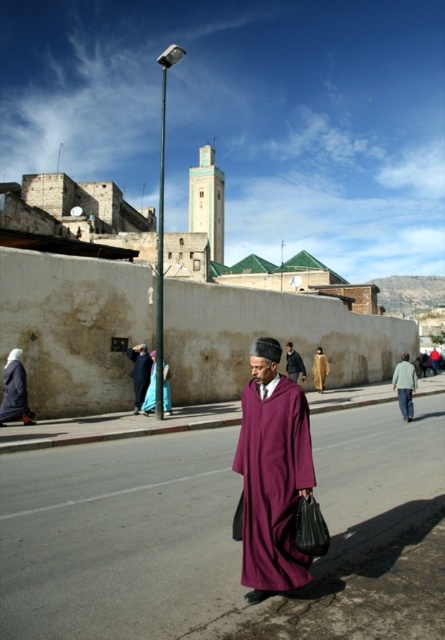
Is purple woolen robe at center taller than blue silk dress at center?

Correct, purple woolen robe at center is much taller as blue silk dress at center.

Is purple woolen robe at center wider than blue silk dress at center?

Yes.

Does point (279, 573) lie behind point (153, 356)?

No.

The image size is (445, 640). I want to click on purple woolen robe at center, so click(x=272, y=481).

Does dark blue fabric headscarf at lower left come behind tan woolen shawl at center?

No, dark blue fabric headscarf at lower left is in front of tan woolen shawl at center.

Is dark blue fabric headscarf at lower left closer to camera compared to tan woolen shawl at center?

Yes, it is.

The image size is (445, 640). In order to click on dark blue fabric headscarf at lower left in this screenshot , I will do `click(15, 390)`.

Who is more distant from viewer, (152, 364) or (298, 372)?

The point (298, 372) is more distant.

Which is above, blue silk dress at center or purple fabric at center?

purple fabric at center is higher up.

Identify the location of blue silk dress at center. (150, 387).

Locate an element on the screen. This screenshot has height=640, width=445. blue silk dress at center is located at coordinates (150, 387).